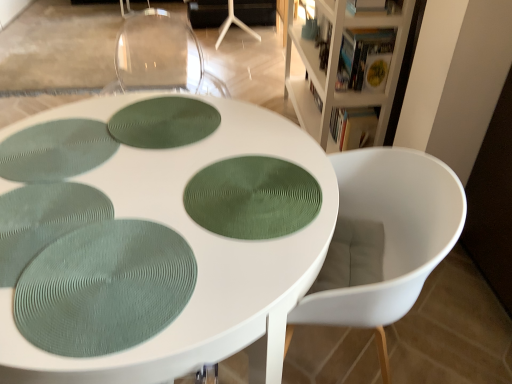
Where is `free space in front of green textured placemat at center, acting as the 2th oval starting from the front`? The image size is (512, 384). free space in front of green textured placemat at center, acting as the 2th oval starting from the front is located at coordinates (204, 285).